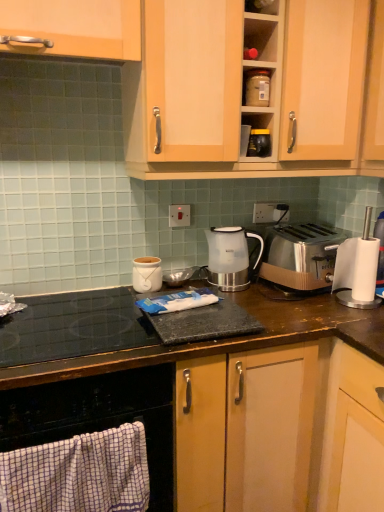
In order to click on free space in front of white glossy electric kettle at center, the second kitchen appliance positioned from the right in this screenshot , I will do `click(258, 298)`.